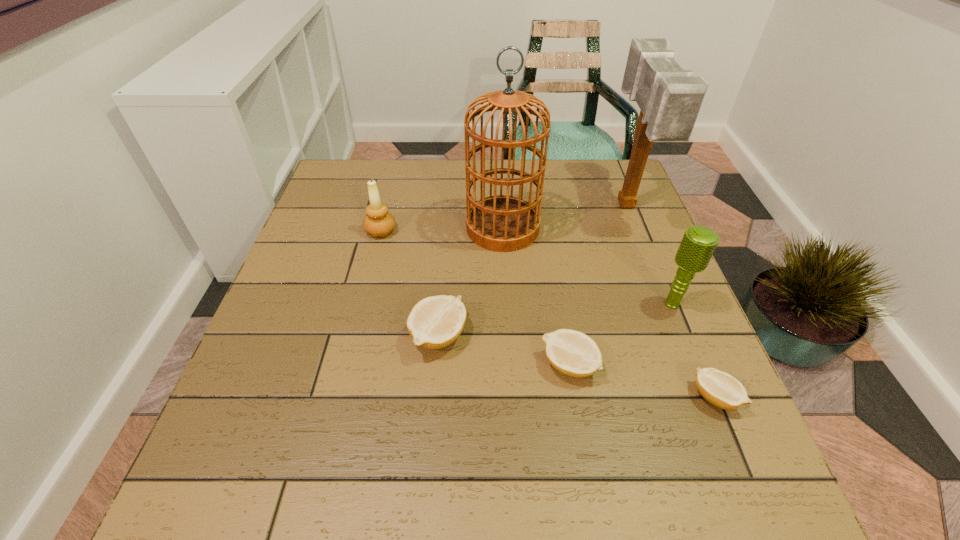
What are the coordinates of `the third shortest object` in the screenshot? It's located at (434, 322).

Locate an element on the screen. The width and height of the screenshot is (960, 540). the tallest lemon is located at coordinates (434, 322).

The image size is (960, 540). What are the coordinates of `the second shortest object` in the screenshot? It's located at (573, 353).

At what (x,y) coordinates should I click in order to perform the action: click on the second lemon from right to left. Please return your answer as a coordinate pair (x, y). Looking at the image, I should click on (573, 353).

Where is `the shortest object`? The image size is (960, 540). the shortest object is located at coordinates (719, 388).

The height and width of the screenshot is (540, 960). In order to click on the shortest lemon in this screenshot , I will do `click(719, 388)`.

Identify the location of mallet. Image resolution: width=960 pixels, height=540 pixels. (669, 98).

Where is `birdcage`? The height and width of the screenshot is (540, 960). birdcage is located at coordinates (502, 223).

Locate an element on the screen. the fourth tallest object is located at coordinates (378, 222).

The image size is (960, 540). Identify the location of the leftmost object. (378, 222).